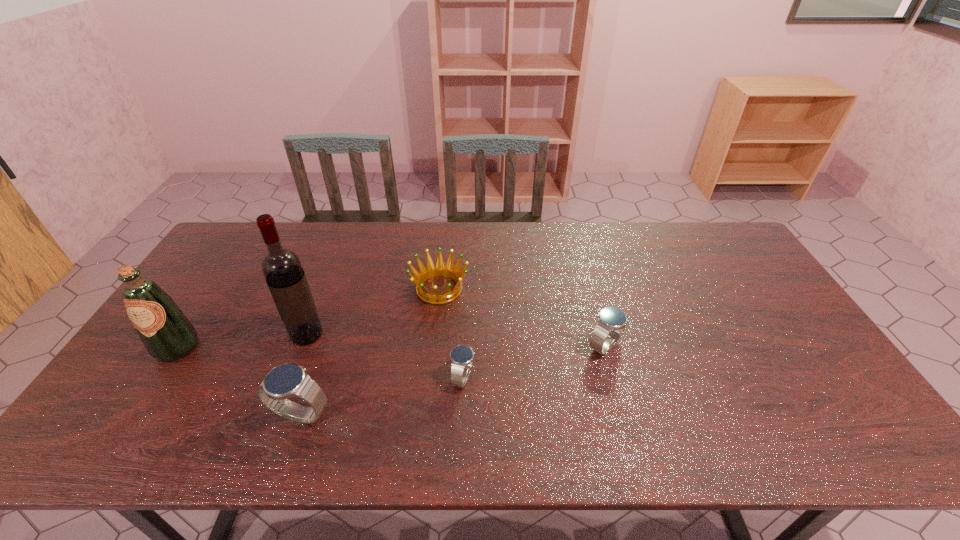
You are a GUI agent. You are given a task and a screenshot of the screen. Output one action in this format:
    pyautogui.click(x=<x>, y=<y>)
    Task: Click on the tallest watch
    The height and width of the screenshot is (540, 960).
    Given the screenshot: What is the action you would take?
    tap(288, 380)

Locate an element on the screen. the fourth shortest object is located at coordinates (288, 380).

In order to click on the second watch from right to left in this screenshot , I will do `click(461, 356)`.

Identify the location of the rightmost object. This screenshot has height=540, width=960. (611, 323).

The width and height of the screenshot is (960, 540). I want to click on the fourth tallest object, so click(611, 323).

Find the location of a particular element. This screenshot has height=540, width=960. the fifth shortest object is located at coordinates (167, 334).

Identify the location of the leftmost object. Image resolution: width=960 pixels, height=540 pixels. (167, 334).

This screenshot has width=960, height=540. I want to click on wine bottle, so click(282, 269).

Locate an element on the screen. crown is located at coordinates (440, 270).

The width and height of the screenshot is (960, 540). In order to click on free space located on the back of the nearest watch in this screenshot , I will do coord(344,288).